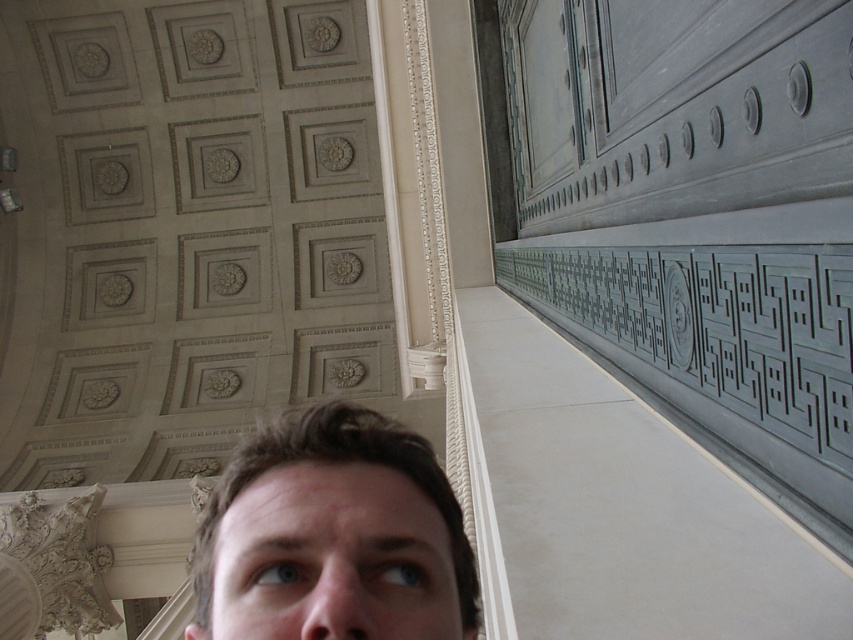
You are an artist observing the image and want to sketch the brown hair at center and the gray stone carving at right. Which object should you focus on first if you want to draw the larger one first?

The brown hair at center is larger in size than the gray stone carving at right, so you should focus on drawing the brown hair at center first.

You are an art conservator examining the ceiling and walls of a historic building. You notice two elements of interest in the image provided. The first is the brown hair at center, and the second is the gray stone carving at right. Based on their positions, can you determine which element is positioned higher up in the scene?

The gray stone carving at right is positioned higher up than the brown hair at center because the brown hair at center is located below it.